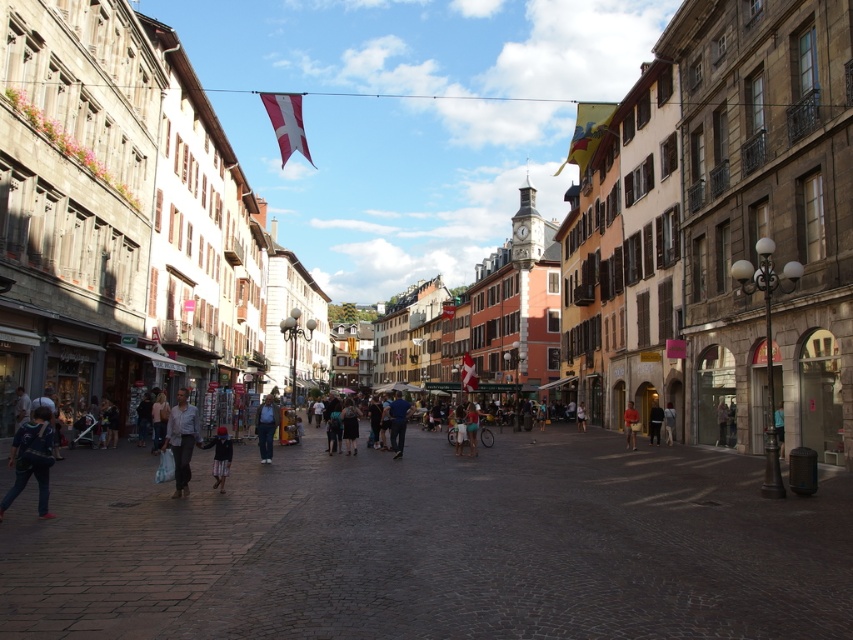
You are standing at the center of the street and want to find the striped shirt at lower left. According to the coordinates provided, in which direction should you look to locate it?

The striped shirt at lower left is located at coordinates point (32, 460), which means you should look to the lower left direction to find it.

You are a photographer standing on the cobblestone pavement in the middle of the street. You want to capture a photo that includes both the striped shirt at lower left and the yellow fabric flag at upper right. Which object should you adjust your camera angle to focus on first if you want to ensure both are in frame?

The striped shirt at lower left is thinner than the yellow fabric flag at upper right, so you should focus on the yellow fabric flag at upper right first to ensure both fit within the frame.